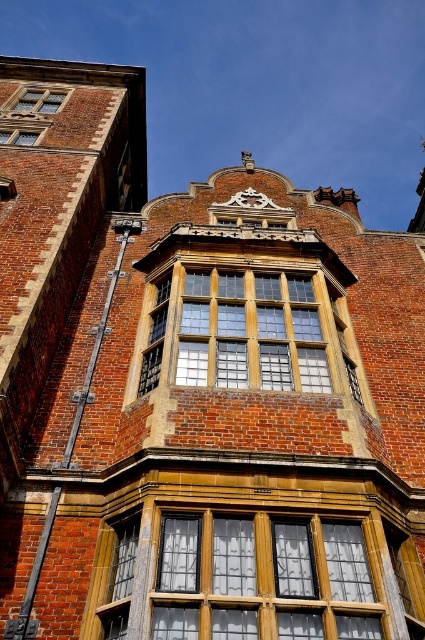
Question: Which object is the farthest from the clear glass window at upper left?

Choices:
 (A) matte glass window at upper left
 (B) clear glass windows at center
 (C) wooden textured window at center

Answer: (B)

Question: Is clear glass windows at center to the right of wooden textured window at center from the viewer's perspective?

Choices:
 (A) no
 (B) yes

Answer: (A)

Question: Which point is farther to the camera?

Choices:
 (A) (227, 541)
 (B) (14, 129)
 (C) (42, 108)
 (D) (246, 316)

Answer: (C)

Question: Can you confirm if clear glass window at upper left is thinner than matte glass window at upper left?

Choices:
 (A) no
 (B) yes

Answer: (A)

Question: From the image, what is the correct spatial relationship of clear glass windows at center in relation to wooden textured window at center?

Choices:
 (A) left
 (B) right

Answer: (A)

Question: Which point appears closest to the camera in this image?

Choices:
 (A) (8, 140)
 (B) (272, 515)
 (C) (280, 340)
 (D) (57, 90)

Answer: (B)